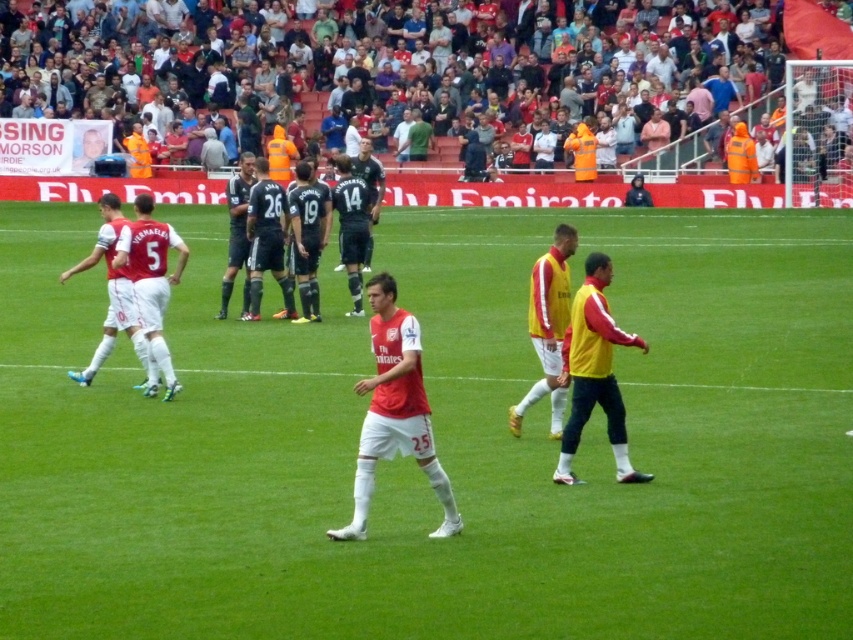
Question: Which point appears closest to the camera in this image?

Choices:
 (A) (155, 388)
 (B) (701, 10)
 (C) (573, 420)
 (D) (817, 516)

Answer: (D)

Question: Is yellow/yellowish fabric jacket at right above white matte jersey at left?

Choices:
 (A) yes
 (B) no

Answer: (B)

Question: Can you confirm if matte red jersey at center is thinner than white matte jersey at left?

Choices:
 (A) no
 (B) yes

Answer: (A)

Question: Which object is the closest to the white matte jersey at left?

Choices:
 (A) white cotton shirt at upper center
 (B) green grass football field at center

Answer: (B)

Question: Can you confirm if matte red jersey at center is positioned to the left of yellow/yellowish fabric jacket at right?

Choices:
 (A) yes
 (B) no

Answer: (A)

Question: Among these objects, which one is nearest to the camera?

Choices:
 (A) matte red jersey at center
 (B) white cotton shirt at upper center
 (C) white matte jersey at left

Answer: (A)